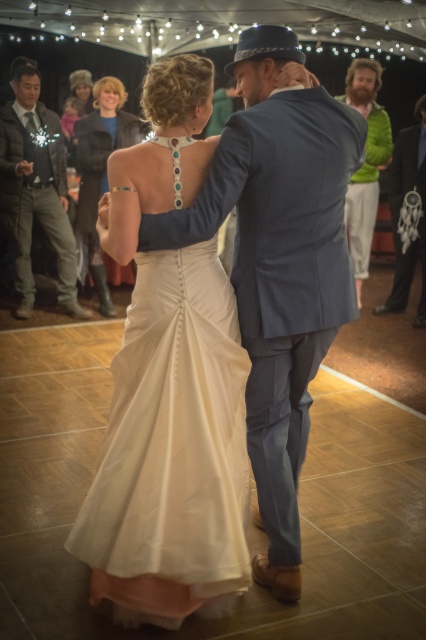
Question: Which point appears farthest from the camera in this image?

Choices:
 (A) (348, 81)
 (B) (124, 124)
 (C) (140, 445)

Answer: (B)

Question: In this image, where is dark green jacket at left located relative to ivory satin dress at center?

Choices:
 (A) right
 (B) left

Answer: (B)

Question: Does satin dress at center appear over dark green jacket at left?

Choices:
 (A) no
 (B) yes

Answer: (A)

Question: Is green fabric dreamcatcher at right further to camera compared to green fuzzy sweater at upper right?

Choices:
 (A) yes
 (B) no

Answer: (B)

Question: Which object appears closest to the camera in this image?

Choices:
 (A) green fabric dreamcatcher at right
 (B) satin dress at center

Answer: (B)

Question: Which point is farther to the camera?

Choices:
 (A) ivory satin dress at center
 (B) green fabric dreamcatcher at right

Answer: (A)